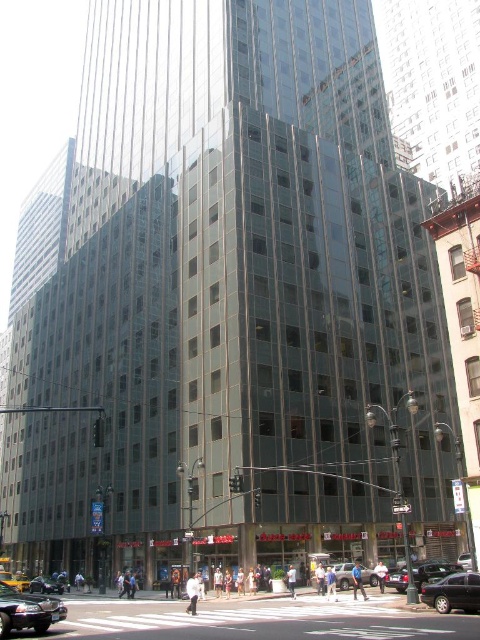
Question: Which object is the closest to the black glossy sedan at center?

Choices:
 (A) metallic silver sedan at center
 (B) silver metallic suv at center
 (C) shiny black sedan at center
 (D) shiny black sedan at lower left

Answer: (D)

Question: Does shiny black sedan at lower left appear on the left side of yellow rubber taxi at lower left?

Choices:
 (A) no
 (B) yes

Answer: (A)

Question: Which of the following is the closest to the observer?

Choices:
 (A) (51, 582)
 (B) (373, 577)
 (C) (443, 584)

Answer: (C)

Question: Does black glossy sedan at center have a smaller size compared to yellow rubber taxi at lower left?

Choices:
 (A) yes
 (B) no

Answer: (A)

Question: Is the position of shiny black sedan at lower left more distant than that of silver metallic suv at center?

Choices:
 (A) no
 (B) yes

Answer: (A)

Question: Among these objects, which one is nearest to the camera?

Choices:
 (A) metallic silver sedan at center
 (B) black glossy sedan at center
 (C) yellow rubber taxi at lower left
 (D) silver metallic suv at center

Answer: (A)